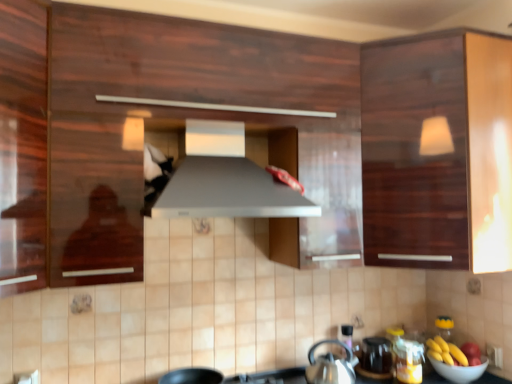
Question: Considering the relative sizes of silver metallic kettle at lower center and matte black kettle at lower center in the image provided, is silver metallic kettle at lower center wider than matte black kettle at lower center?

Choices:
 (A) no
 (B) yes

Answer: (B)

Question: From a real-world perspective, is silver metallic kettle at lower center on matte black kettle at lower center?

Choices:
 (A) no
 (B) yes

Answer: (B)

Question: Considering the relative sizes of silver metallic kettle at lower center and matte black kettle at lower center in the image provided, is silver metallic kettle at lower center bigger than matte black kettle at lower center?

Choices:
 (A) yes
 (B) no

Answer: (A)

Question: Is silver metallic kettle at lower center at the right side of matte black kettle at lower center?

Choices:
 (A) no
 (B) yes

Answer: (A)

Question: Considering the relative sizes of silver metallic kettle at lower center and matte black kettle at lower center in the image provided, is silver metallic kettle at lower center taller than matte black kettle at lower center?

Choices:
 (A) yes
 (B) no

Answer: (A)

Question: Considering the relative positions of silver metallic kettle at lower center and matte black kettle at lower center in the image provided, is silver metallic kettle at lower center to the left of matte black kettle at lower center from the viewer's perspective?

Choices:
 (A) no
 (B) yes

Answer: (B)

Question: From the image's perspective, is glossy wood cabinet at upper right below white glossy bowl at lower right?

Choices:
 (A) no
 (B) yes

Answer: (A)

Question: Can you confirm if glossy wood cabinet at upper right is taller than white glossy bowl at lower right?

Choices:
 (A) no
 (B) yes

Answer: (B)

Question: Considering the relative sizes of glossy wood cabinet at upper right and white glossy bowl at lower right in the image provided, is glossy wood cabinet at upper right thinner than white glossy bowl at lower right?

Choices:
 (A) no
 (B) yes

Answer: (A)

Question: Considering the relative sizes of glossy wood cabinet at upper right and white glossy bowl at lower right in the image provided, is glossy wood cabinet at upper right bigger than white glossy bowl at lower right?

Choices:
 (A) no
 (B) yes

Answer: (B)

Question: Is glossy wood cabinet at upper right to the right of white glossy bowl at lower right from the viewer's perspective?

Choices:
 (A) no
 (B) yes

Answer: (A)

Question: Is glossy wood cabinet at upper right oriented away from white glossy bowl at lower right?

Choices:
 (A) no
 (B) yes

Answer: (A)

Question: Considering the relative positions of matte black kettle at lower center and glossy wood cabinet at upper right in the image provided, is matte black kettle at lower center to the left of glossy wood cabinet at upper right from the viewer's perspective?

Choices:
 (A) yes
 (B) no

Answer: (A)